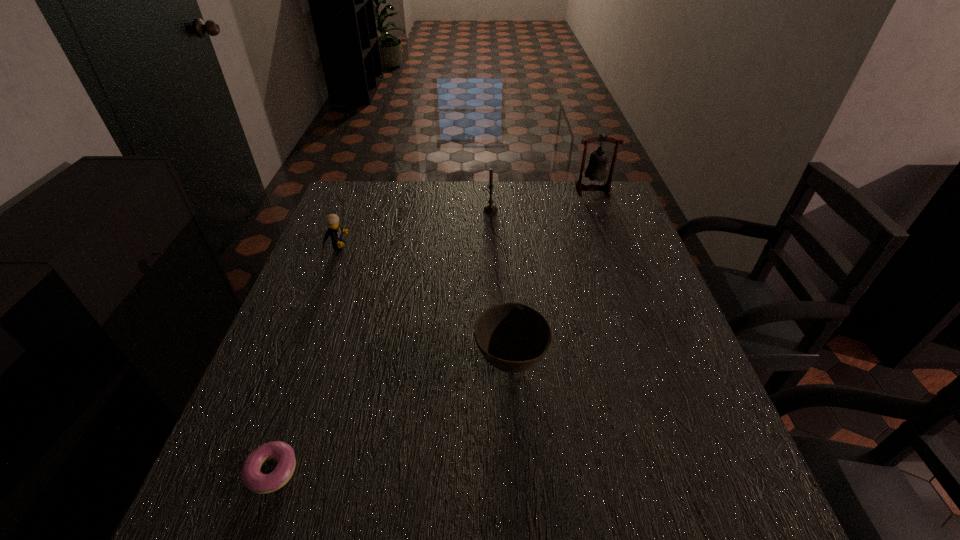
This screenshot has width=960, height=540. I want to click on vacant space located 0.080m on the front-facing side of the third farthest object, so click(x=377, y=246).

This screenshot has height=540, width=960. In order to click on free space located 0.160m on the right of the second nearest object in this screenshot , I will do `click(623, 362)`.

This screenshot has height=540, width=960. I want to click on blank space located 0.280m on the right of the nearest object, so click(459, 471).

Where is `bell located in the far edge section of the desktop`? bell located in the far edge section of the desktop is located at coordinates click(x=596, y=170).

You are a GUI agent. You are given a task and a screenshot of the screen. Output one action in this format:
    pyautogui.click(x=<x>, y=<y>)
    Task: Click on the candle positioned at the far edge
    This screenshot has width=960, height=540.
    Given the screenshot: What is the action you would take?
    pyautogui.click(x=490, y=208)

Locate an element on the screen. This screenshot has height=540, width=960. object that is at the near edge is located at coordinates (257, 482).

Find the location of `Lego present at the left edge`. Lego present at the left edge is located at coordinates (334, 231).

This screenshot has height=540, width=960. I want to click on doughnut positioned at the left edge, so click(x=257, y=482).

This screenshot has width=960, height=540. Find the location of `object located at the right edge`. object located at the right edge is located at coordinates (596, 170).

This screenshot has width=960, height=540. What are the coordinates of `object positioned at the near left corner` in the screenshot? It's located at (257, 482).